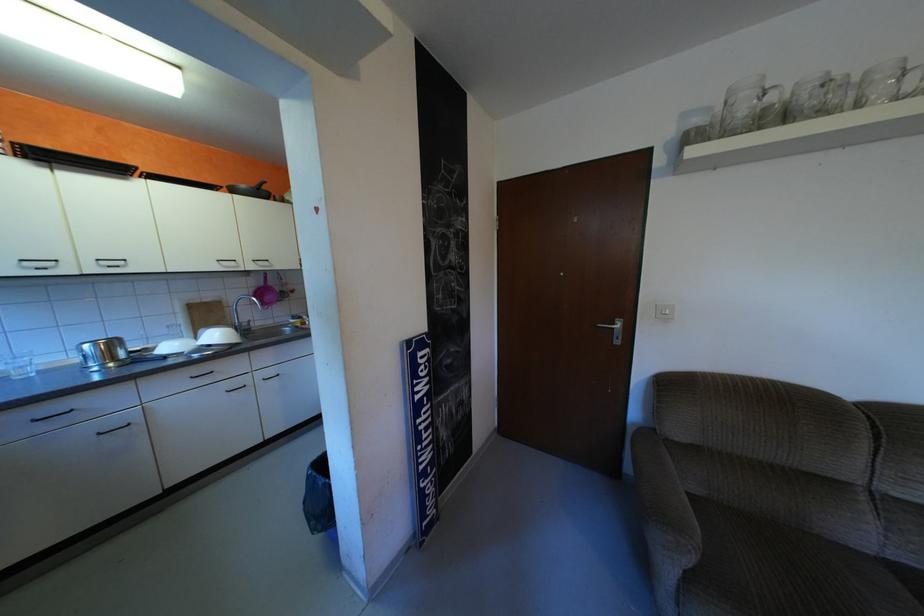
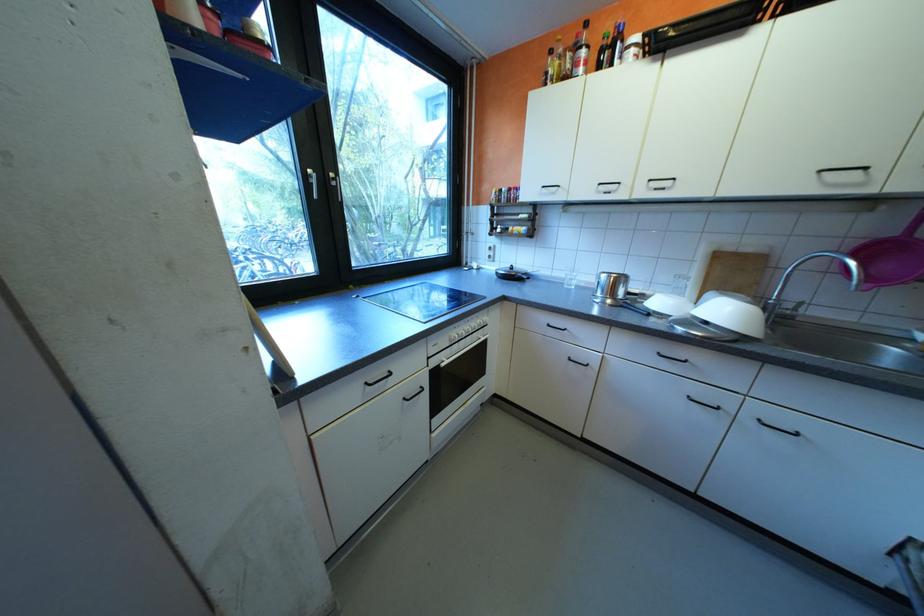
Where in the second image is the point corresponding to point 272,381 from the first image?

(760, 419)